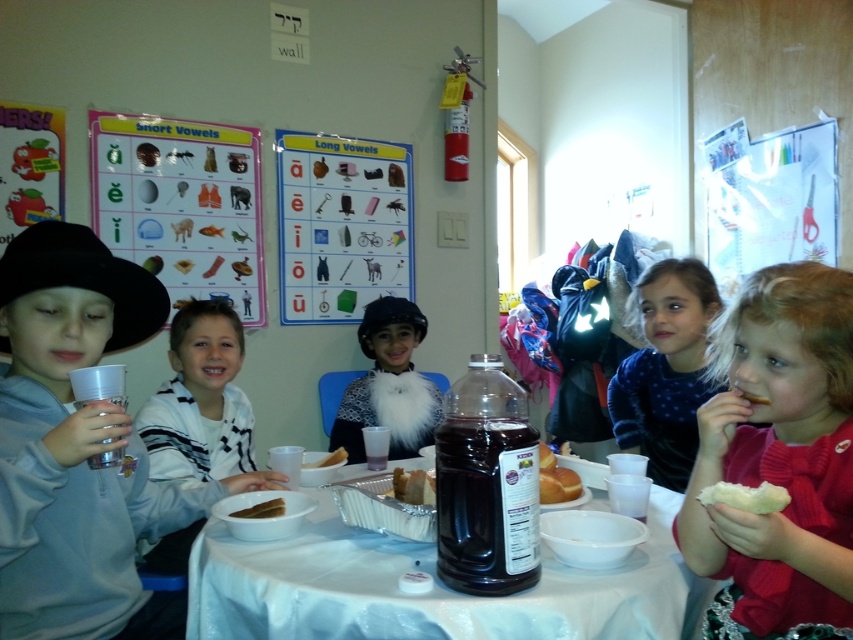
You are a teacher in the classroom and want to distribute snacks to the children. You have a white paper plate at center and brown bread at lower right. Which item can hold more food?

The white paper plate at center has a larger size compared to brown bread at lower right, so it can hold more food.

You are a teacher in the classroom. You need to hang the cardboard poster at center and the brown paper bag at center on the wall. Which object should you hang higher to ensure both are visible without overlapping?

The cardboard poster at center is taller than the brown paper bag at center, so you should hang the cardboard poster at center higher to ensure both are visible without overlapping.